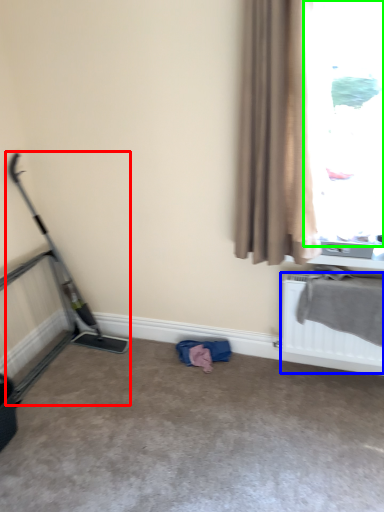
Question: Which object is the closest to the baby carriage (highlighted by a red box)? Choose among these: radiator (highlighted by a blue box) or window (highlighted by a green box).

Choices:
 (A) radiator
 (B) window

Answer: (A)